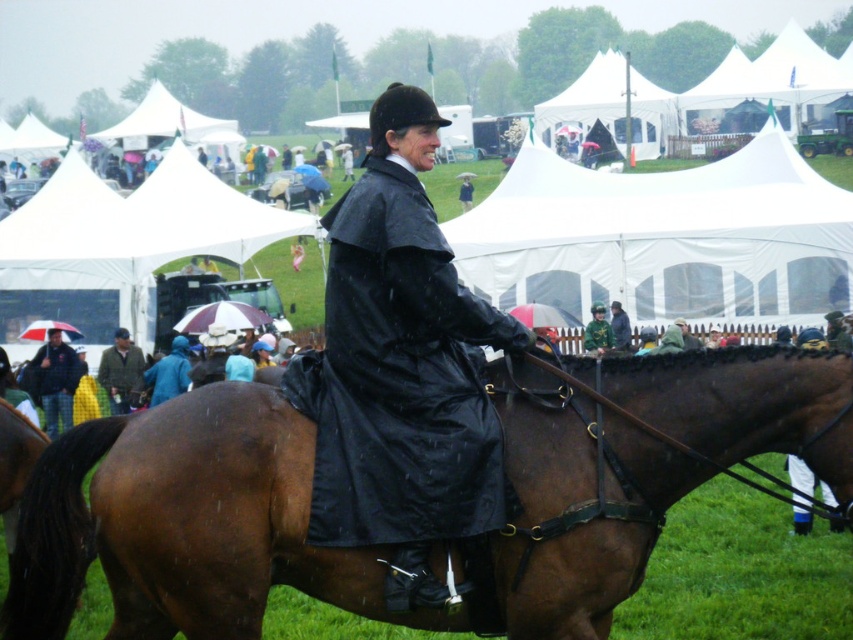
Who is higher up, white canvas tent at upper center or green fabric jacket at center?

white canvas tent at upper center

Does point (643, 77) come behind point (583, 340)?

Yes, point (643, 77) is behind point (583, 340).

The height and width of the screenshot is (640, 853). Describe the element at coordinates (611, 108) in the screenshot. I see `white canvas tent at upper center` at that location.

Locate an element on the screen. The width and height of the screenshot is (853, 640). white canvas tent at upper center is located at coordinates (611, 108).

Is white canvas tent at upper center shorter than camouflage fabric jacket at lower left?

In fact, white canvas tent at upper center may be taller than camouflage fabric jacket at lower left.

Looking at this image, is white canvas tent at upper center positioned in front of camouflage fabric jacket at lower left?

No.

Where is `white canvas tent at upper center`? The height and width of the screenshot is (640, 853). white canvas tent at upper center is located at coordinates (611, 108).

Is brown glossy horse at center taller than plaid fabric jacket at lower left?

In fact, brown glossy horse at center may be shorter than plaid fabric jacket at lower left.

Which is below, brown glossy horse at center or plaid fabric jacket at lower left?

plaid fabric jacket at lower left is lower down.

Does point (230, 490) come farther from viewer compared to point (74, 364)?

No, it is in front of (74, 364).

This screenshot has height=640, width=853. What are the coordinates of `brown glossy horse at center` in the screenshot? It's located at (186, 524).